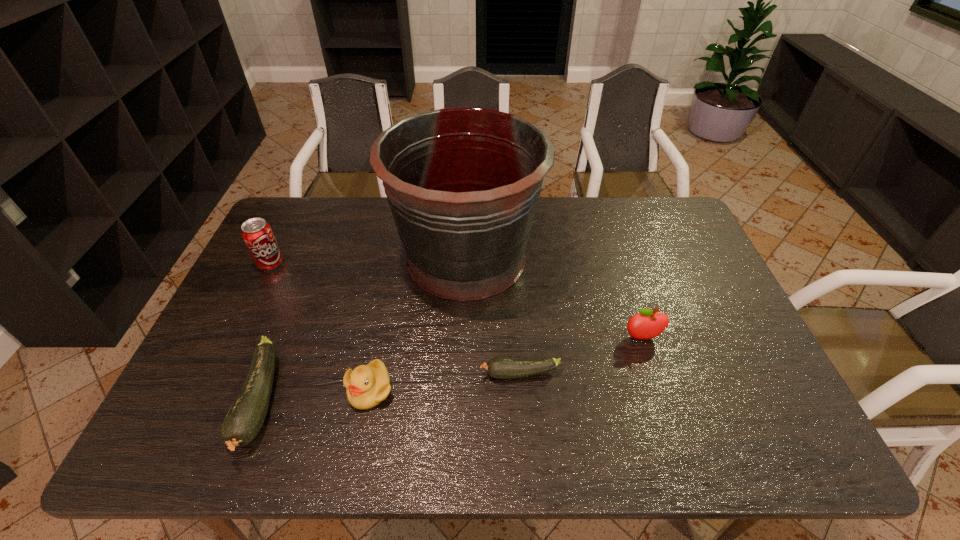
Locate an element on the screen. This screenshot has height=540, width=960. the fifth tallest object is located at coordinates (245, 418).

The image size is (960, 540). I want to click on the left zucchini, so click(x=245, y=418).

You are a GUI agent. You are given a task and a screenshot of the screen. Output one action in this format:
    pyautogui.click(x=<x>, y=<y>)
    Task: Click on the shortest object
    The image size is (960, 540).
    Given the screenshot: What is the action you would take?
    pyautogui.click(x=501, y=368)

Where is `the shorter zucchini`? This screenshot has width=960, height=540. the shorter zucchini is located at coordinates (501, 368).

Find the location of `the leftmost object`. the leftmost object is located at coordinates (258, 236).

Locate an element on the screen. Image resolution: width=960 pixels, height=540 pixels. the second tallest object is located at coordinates (258, 236).

You are a GUI agent. You are given a task and a screenshot of the screen. Output one action in this format:
    pyautogui.click(x=<x>, y=<y>)
    Task: Click on the rightmost object
    The image size is (960, 540).
    Given the screenshot: What is the action you would take?
    pyautogui.click(x=645, y=325)

The width and height of the screenshot is (960, 540). I want to click on the fourth shortest object, so click(645, 325).

I want to click on bucket, so click(463, 184).

The image size is (960, 540). Find the location of `duckling`. duckling is located at coordinates (368, 385).